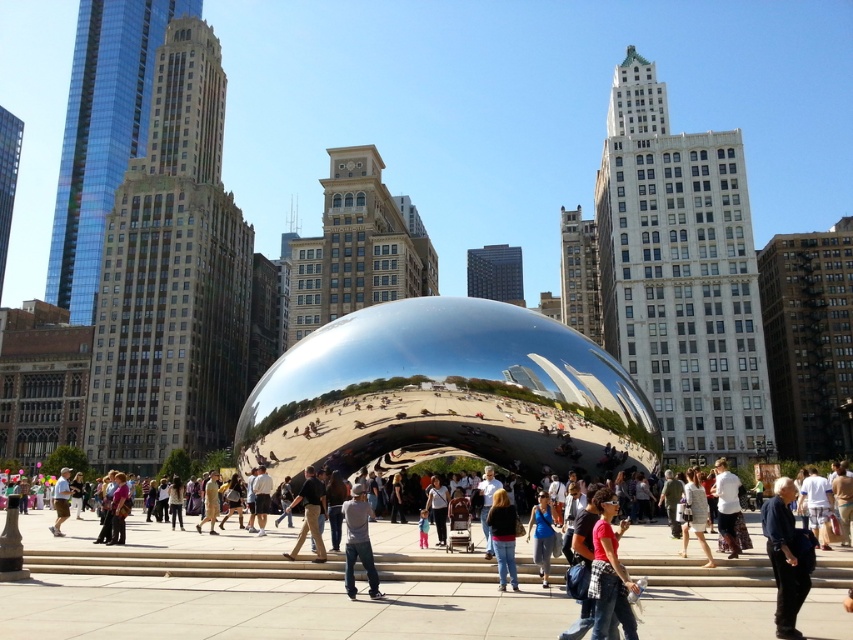
Question: Which point appears farthest from the camera in this image?

Choices:
 (A) (361, 484)
 (B) (322, 497)
 (C) (776, 504)
 (D) (512, 580)

Answer: (B)

Question: Which object is closer to the camera taking this photo?

Choices:
 (A) dark blue shirt at lower right
 (B) denim jacket at center
 (C) dark brown leather pants at center

Answer: (A)

Question: Does denim jacket at center lie in front of dark brown leather pants at center?

Choices:
 (A) yes
 (B) no

Answer: (A)

Question: Does dark blue shirt at lower right have a greater width compared to dark brown leather pants at center?

Choices:
 (A) no
 (B) yes

Answer: (B)

Question: Is dark blue shirt at lower right bigger than dark gray jeans at center?

Choices:
 (A) no
 (B) yes

Answer: (B)

Question: Which object appears farthest from the camera in this image?

Choices:
 (A) dark brown leather pants at center
 (B) dark blue shirt at lower right
 (C) denim jacket at center
 (D) dark gray jeans at center

Answer: (A)